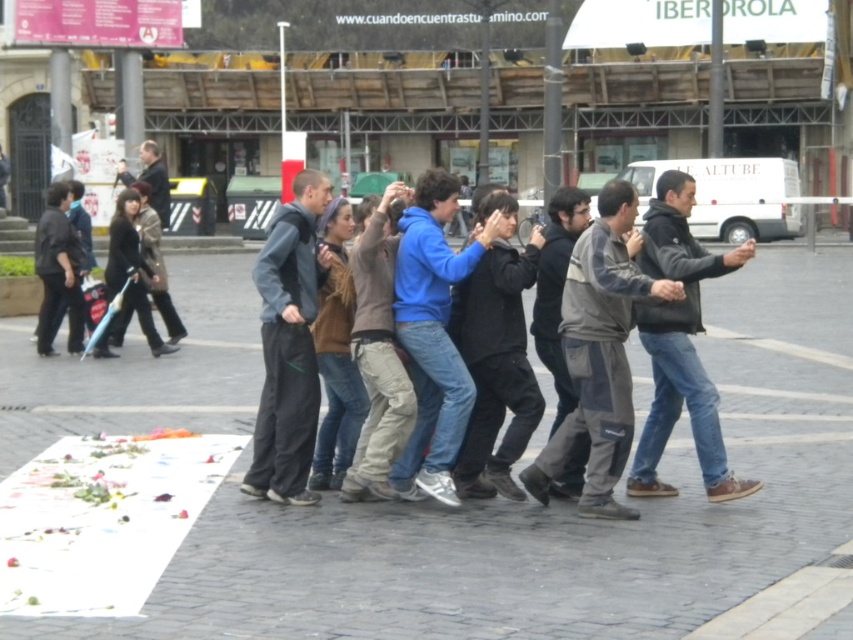
You are standing in the urban square and see two points marked on the ground. The first point is at coordinates point (784, 545) and the second is at point (575, 381). Which point is closer to you?

Point (784, 545) is in front of point (575, 381), so it is closer to you.

In the scene shown: You are a photographer trying to capture a photo of the blue fleece jacket at center and the dark brown leather jacket at left. Based on their sizes in the image, which jacket would appear larger in the final photo?

The dark brown leather jacket at left appears larger in the photo because it is taller than the blue fleece jacket at center.